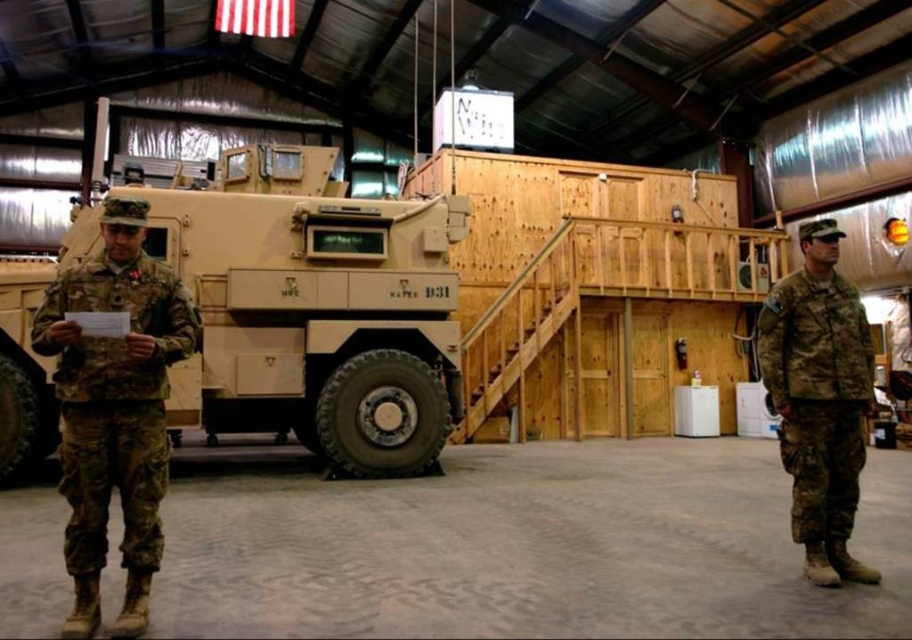
Is the position of camouflage fabric uniform at left less distant than that of camouflage fabric uniform at right?

Yes.

Is point (130, 602) farther from viewer compared to point (832, 353)?

No.

This screenshot has height=640, width=912. I want to click on camouflage fabric uniform at left, so click(x=114, y=406).

Identify the location of camouflage fabric uniform at left. The image size is (912, 640). (114, 406).